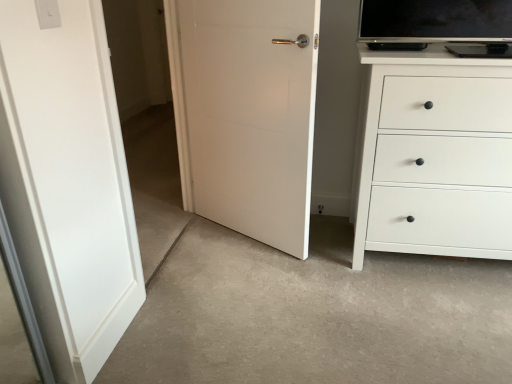
Question: Considering the positions of white plastic light switch at upper left and transparent glass door at left in the image, is white plastic light switch at upper left bigger or smaller than transparent glass door at left?

Choices:
 (A) small
 (B) big

Answer: (A)

Question: Is point (49, 23) closer or farther from the camera than point (143, 241)?

Choices:
 (A) farther
 (B) closer

Answer: (B)

Question: Which of these objects is positioned farthest from the transparent glass door at left?

Choices:
 (A) white matte door at center
 (B) white matte chest of drawers at right
 (C) white plastic light switch at upper left

Answer: (C)

Question: Estimate the real-world distances between objects in this image. Which object is farther from the white plastic light switch at upper left?

Choices:
 (A) transparent glass door at left
 (B) white matte door at center
 (C) white matte chest of drawers at right

Answer: (A)